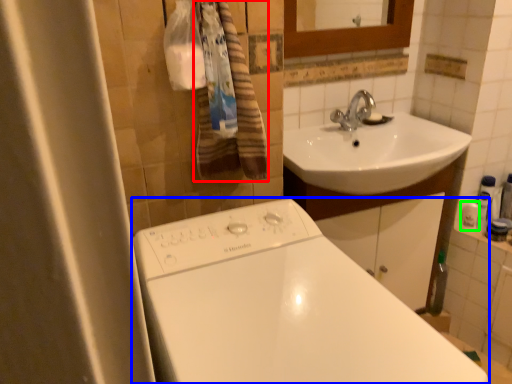
Question: Considering the real-world distances, which object is farthest from bath towel (highlighted by a red box)? bathtub (highlighted by a blue box) or toiletry (highlighted by a green box)?

Choices:
 (A) bathtub
 (B) toiletry

Answer: (B)